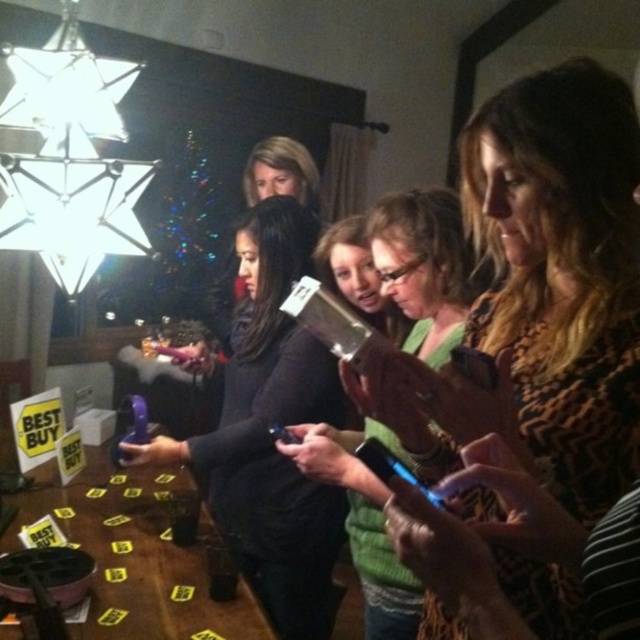
Is point (451, 413) positioned behind point (392, 225)?

No, it is in front of (392, 225).

Who is more distant from viewer, (492, 108) or (307, 424)?

The point (307, 424) is more distant.

Where is `leopard print scarf at center`? leopard print scarf at center is located at coordinates tap(548, 289).

Is point (504, 136) farther from viewer compared to point (225, 620)?

No, it is not.

Is leopard print scarf at center positioned before yellow paper placards at lower left?

That is True.

Between point (566, 440) and point (24, 496), which one is positioned in front?

Positioned in front is point (566, 440).

Where is `leopard print scarf at center`? Image resolution: width=640 pixels, height=640 pixels. leopard print scarf at center is located at coordinates (548, 289).

Does green knitted sweater at center have a greater height compared to yellow paper placards at lower left?

Correct, green knitted sweater at center is much taller as yellow paper placards at lower left.

Who is more distant from viewer, (x=388, y=634) or (x=173, y=634)?

The point (x=388, y=634) is more distant.

At what (x,y) coordinates should I click in order to perform the action: click on green knitted sweater at center. Please return your answer as a coordinate pair (x, y). The width and height of the screenshot is (640, 640). Looking at the image, I should click on tap(422, 268).